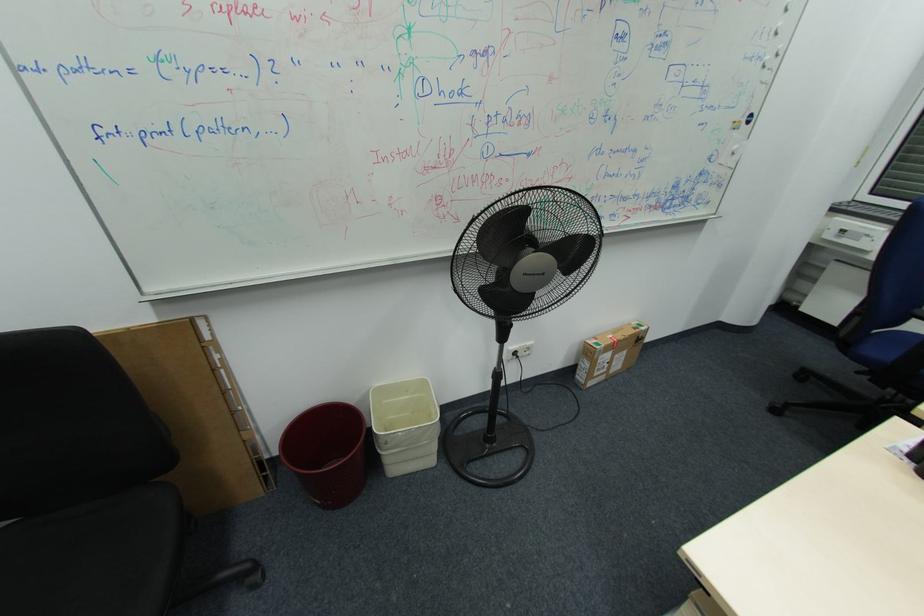
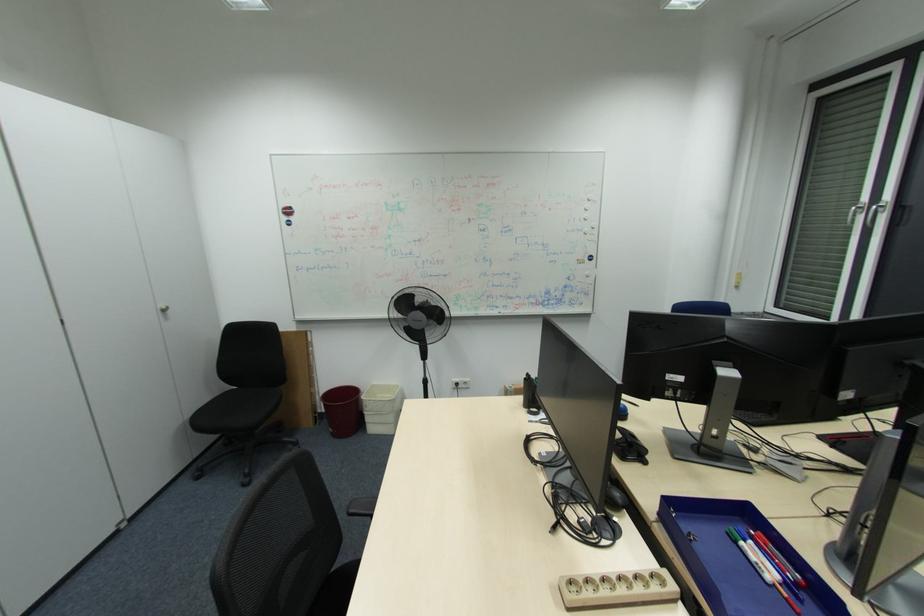
In a continuous first-person perspective shot, in which direction is the camera moving?

The cameraman walked toward right, backward.